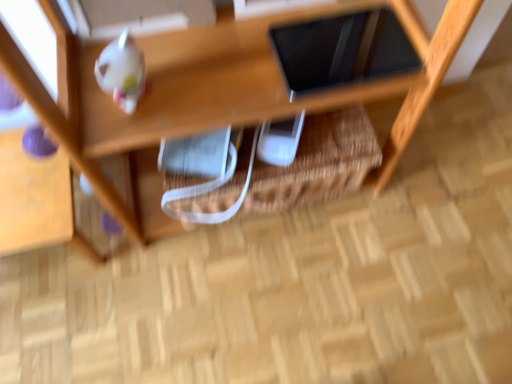
This screenshot has height=384, width=512. Describe the element at coordinates (208, 95) in the screenshot. I see `wooden shelf at upper center` at that location.

Identify the location of woven straw basket at center. The image size is (512, 384). (317, 163).

Find the location of `black glossy tablet at upper center`. black glossy tablet at upper center is located at coordinates (319, 52).

Is wooden shelf at upper center facing towards woven straw basket at center?

No, wooden shelf at upper center is not facing towards woven straw basket at center.

Can you confirm if wooden shelf at upper center is thinner than woven straw basket at center?

No, wooden shelf at upper center is not thinner than woven straw basket at center.

How different are the orientations of wooden shelf at upper center and woven straw basket at center in degrees?

178 degrees separate the facing orientations of wooden shelf at upper center and woven straw basket at center.

Is wooden shelf at upper center spatially inside woven straw basket at center, or outside of it?

wooden shelf at upper center is not inside woven straw basket at center, it's outside.

From the image's perspective, does black glossy tablet at upper center appear higher than wooden shelf at upper center?

Yes, from the image's perspective, black glossy tablet at upper center is above wooden shelf at upper center.

Based on the photo, which is more to the right, black glossy tablet at upper center or wooden shelf at upper center?

black glossy tablet at upper center is more to the right.

Relative to wooden shelf at upper center, is black glossy tablet at upper center in front or behind?

Visually, black glossy tablet at upper center is located in front of wooden shelf at upper center.

Is black glossy tablet at upper center not inside white glossy teapot at upper left?

That's correct, black glossy tablet at upper center is outside of white glossy teapot at upper left.

Is black glossy tablet at upper center shorter than white glossy teapot at upper left?

Indeed, black glossy tablet at upper center has a lesser height compared to white glossy teapot at upper left.

Is point (365, 24) behind point (131, 61)?

Yes, point (365, 24) is farther from viewer.

Which object is more forward, black glossy tablet at upper center or white glossy teapot at upper left?

white glossy teapot at upper left.

At what (x,y) coordinates should I click in order to perform the action: click on basket on the left of wooden shelf at upper center. Please return your answer as a coordinate pair (x, y). This screenshot has height=384, width=512. Looking at the image, I should click on (317, 163).

From a real-world perspective, is woven straw basket at center physically below wooden shelf at upper center?

No, from a real-world perspective, woven straw basket at center is not below wooden shelf at upper center.

Can you see woven straw basket at center touching wooden shelf at upper center?

No.

How different are the orientations of woven straw basket at center and wooden shelf at upper center in degrees?

178 degrees.

Is there a large distance between woven straw basket at center and black glossy tablet at upper center?

No, woven straw basket at center is in close proximity to black glossy tablet at upper center.

The width and height of the screenshot is (512, 384). There is a woven straw basket at center. Find the location of `tablet computer above it (from a real-world perspective)`. tablet computer above it (from a real-world perspective) is located at coordinates (319, 52).

Relative to black glossy tablet at upper center, is woven straw basket at center in front or behind?

woven straw basket at center is behind black glossy tablet at upper center.

Which is behind, point (279, 210) or point (288, 77)?

Positioned behind is point (279, 210).

Is point (298, 183) in front of point (121, 85)?

That is False.

Is woven straw basket at center turned away from white glossy teapot at upper left?

No, woven straw basket at center's orientation is not away from white glossy teapot at upper left.

Identify the location of toy in front of the woven straw basket at center. The height and width of the screenshot is (384, 512). (x=122, y=71).

Which of these two, woven straw basket at center or white glossy teapot at upper left, is wider?

woven straw basket at center.

Would you say wooden shelf at upper center is inside or outside white glossy teapot at upper left?

wooden shelf at upper center exists outside the volume of white glossy teapot at upper left.

From the image's perspective, which one is positioned lower, wooden shelf at upper center or white glossy teapot at upper left?

wooden shelf at upper center, from the image's perspective.

The height and width of the screenshot is (384, 512). In order to click on shelf below the white glossy teapot at upper left (from the image's perspective) in this screenshot , I will do `click(208, 95)`.

How different are the orientations of wooden shelf at upper center and white glossy teapot at upper left in degrees?

They differ by 179 degrees in their facing directions.

This screenshot has width=512, height=384. I want to click on shelf below the woven straw basket at center (from the image's perspective), so click(208, 95).

Identify the location of shelf below the black glossy tablet at upper center (from a real-world perspective). The height and width of the screenshot is (384, 512). (208, 95).

Based on their spatial positions, is white glossy teapot at upper left or wooden shelf at upper center further from black glossy tablet at upper center?

The object further to black glossy tablet at upper center is white glossy teapot at upper left.

Based on their spatial positions, is black glossy tablet at upper center or wooden shelf at upper center further from woven straw basket at center?

Based on the image, black glossy tablet at upper center appears to be further to woven straw basket at center.

Considering their positions, is woven straw basket at center positioned closer to white glossy teapot at upper left than black glossy tablet at upper center?

Based on the image, black glossy tablet at upper center appears to be nearer to white glossy teapot at upper left.

When comparing their distances from white glossy teapot at upper left, does black glossy tablet at upper center or woven straw basket at center seem closer?

Among the two, black glossy tablet at upper center is located nearer to white glossy teapot at upper left.

Looking at the image, which one is located further to black glossy tablet at upper center, woven straw basket at center or wooden shelf at upper center?

woven straw basket at center lies further to black glossy tablet at upper center than the other object.

From the picture: Looking at the image, which one is located closer to white glossy teapot at upper left, wooden shelf at upper center or woven straw basket at center?

wooden shelf at upper center lies closer to white glossy teapot at upper left than the other object.

From the picture: Which object lies nearer to the anchor point woven straw basket at center, wooden shelf at upper center or black glossy tablet at upper center?

Based on the image, wooden shelf at upper center appears to be nearer to woven straw basket at center.

Estimate the real-world distances between objects in this image. Which object is further from woven straw basket at center, wooden shelf at upper center or white glossy teapot at upper left?

Among the two, white glossy teapot at upper left is located further to woven straw basket at center.

This screenshot has height=384, width=512. Identify the location of basket that lies between black glossy tablet at upper center and wooden shelf at upper center from top to bottom. (317, 163).

Where is `shelf located between white glossy teapot at upper left and black glossy tablet at upper center in the left-right direction`? This screenshot has width=512, height=384. shelf located between white glossy teapot at upper left and black glossy tablet at upper center in the left-right direction is located at coordinates (208, 95).

You are a GUI agent. You are given a task and a screenshot of the screen. Output one action in this format:
    pyautogui.click(x=<x>, y=<y>)
    Task: Click on the basket between white glossy teapot at upper left and black glossy tablet at upper center
    This screenshot has height=384, width=512.
    Given the screenshot: What is the action you would take?
    pyautogui.click(x=317, y=163)

This screenshot has height=384, width=512. I want to click on basket between white glossy teapot at upper left and wooden shelf at upper center from left to right, so click(x=317, y=163).